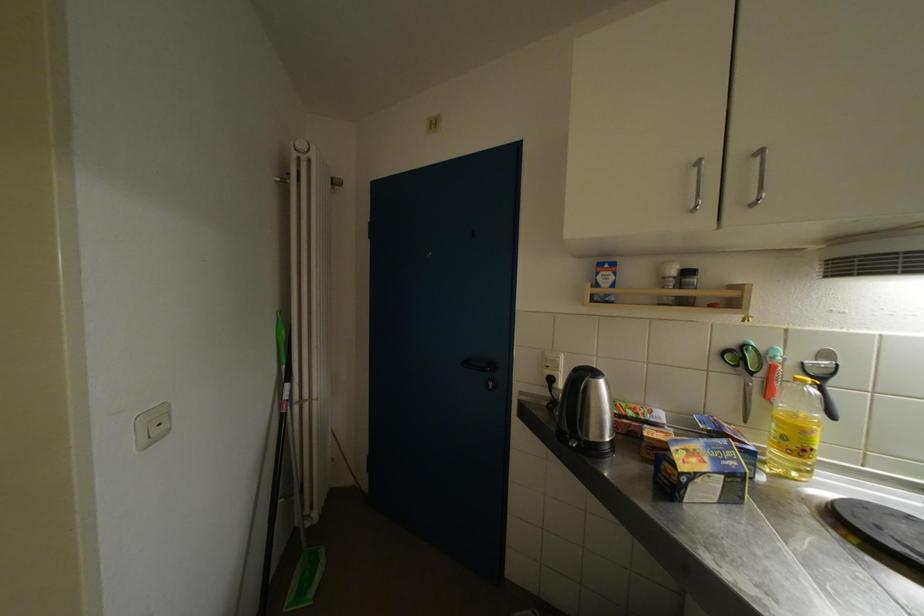
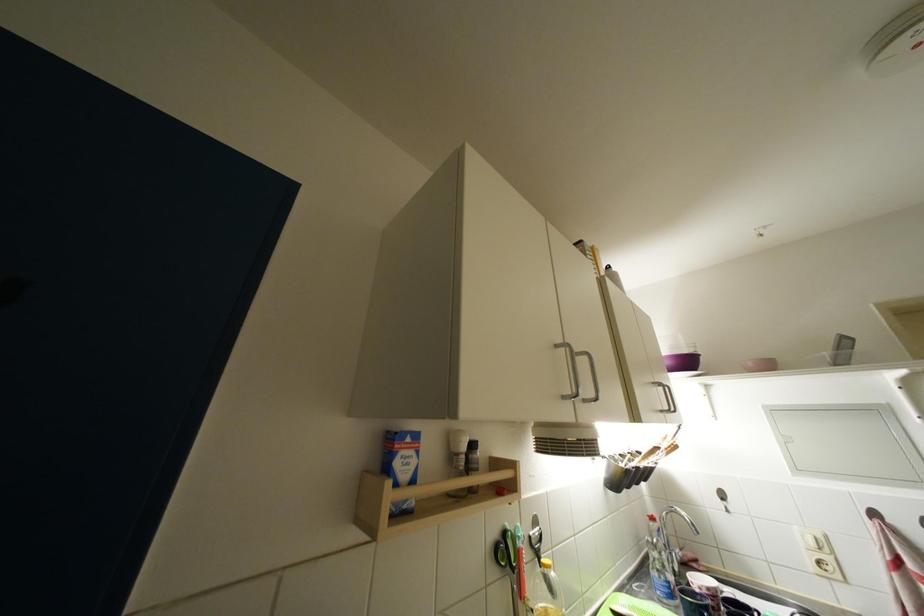
Where in the second image is the point corresponding to pixel 606 282 from the first image?

(404, 467)